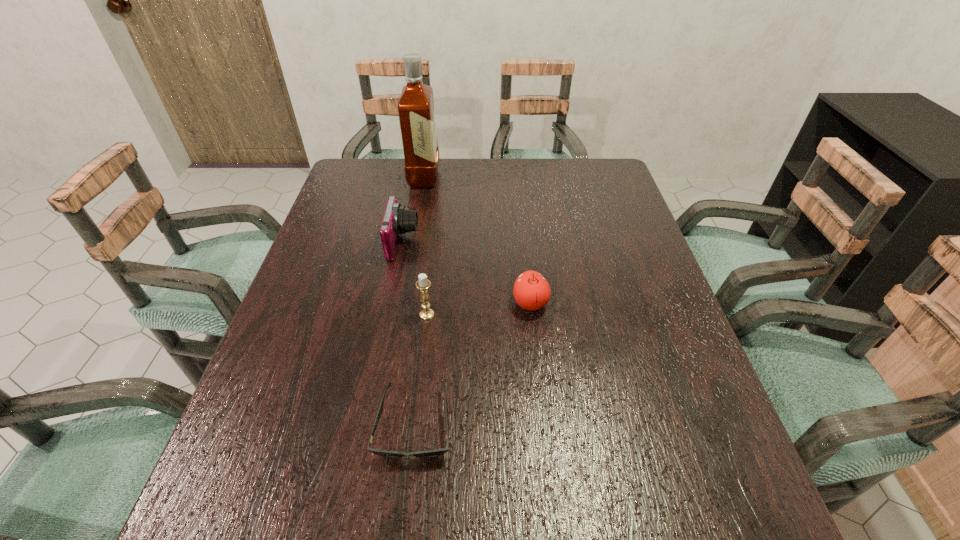
I want to click on vacant area between the rightmost object and the nearest object, so click(472, 364).

The width and height of the screenshot is (960, 540). In order to click on free space between the rightmost object and the candle holder in this screenshot , I will do `click(479, 309)`.

Find the location of a particular element. Image resolution: width=960 pixels, height=540 pixels. blank region between the liquor and the fourth shortest object is located at coordinates (425, 246).

Locate an element on the screen. vacant area between the rightmost object and the camera is located at coordinates (467, 273).

At what (x,y) coordinates should I click in order to perform the action: click on free space between the farthest object and the second tallest object. Please return your answer as a coordinate pair (x, y). The image size is (960, 540). Looking at the image, I should click on (425, 246).

This screenshot has height=540, width=960. Identify the location of free area in between the camera and the rightmost object. (467, 273).

At what (x,y) coordinates should I click in order to perform the action: click on object that can be found as the third closest to the second farthest object. Please return your answer as a coordinate pair (x, y). The height and width of the screenshot is (540, 960). Looking at the image, I should click on (531, 290).

Select which object is the fourth closest to the nearest object. Please provide its 2D coordinates. Your answer should be formatted as a tuple, i.e. [(x, y)], where the tuple contains the x and y coordinates of a point satisfying the conditions above.

[(416, 112)]

Find the location of a particular element. blank area in the image that satisfies the following two spatial constraints: 1. on the front label of the tallest object; 2. on the left side of the rightmost object is located at coordinates (402, 303).

At what (x,y) coordinates should I click in order to perform the action: click on free space that satisfies the following two spatial constraints: 1. on the back side of the apple; 2. on the front-facing side of the camera. Please return your answer as a coordinate pair (x, y). The height and width of the screenshot is (540, 960). Looking at the image, I should click on (524, 243).